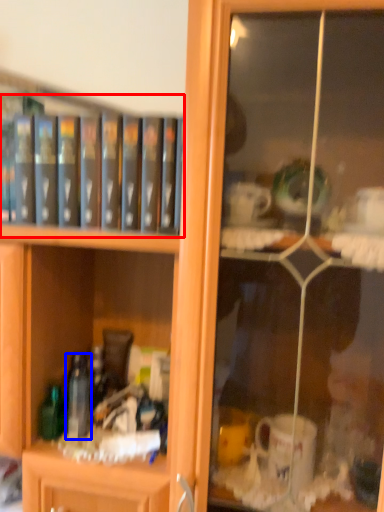
Question: Which point is further to the camera, book (highlighted by a red box) or bottle (highlighted by a blue box)?

Choices:
 (A) book
 (B) bottle

Answer: (B)